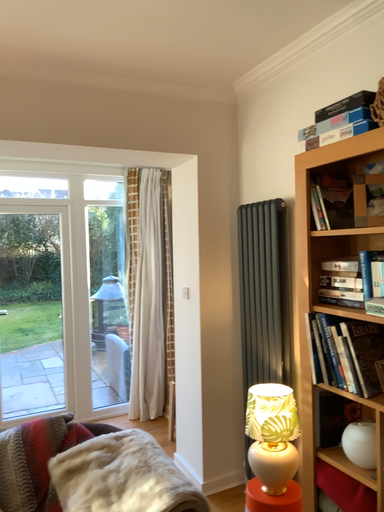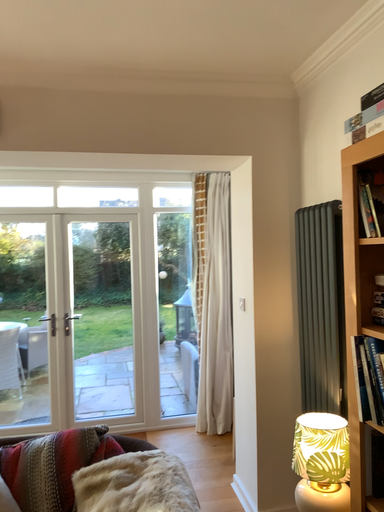
Question: Which way did the camera rotate in the video?

Choices:
 (A) rotated left
 (B) rotated right

Answer: (A)